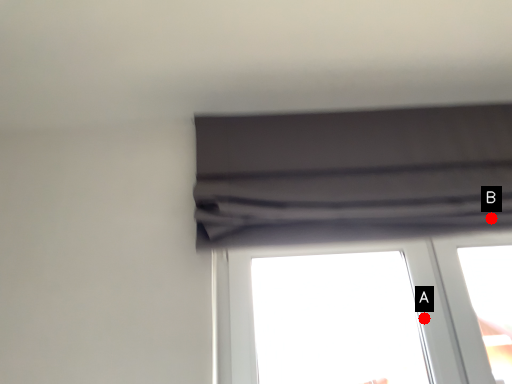
Question: Two points are circled on the image, labeled by A and B beside each circle. Which point appears farthest from the camera in this image?

Choices:
 (A) A is further
 (B) B is further

Answer: (A)